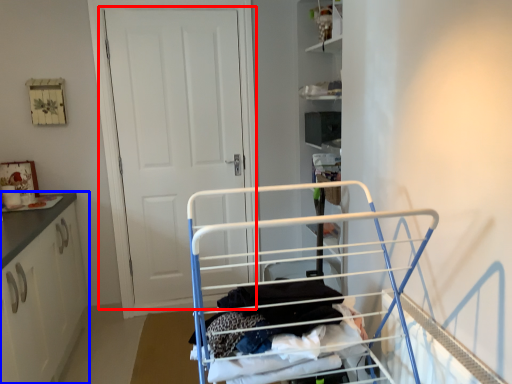
Question: Among these objects, which one is nearest to the camera, door (highlighted by a red box) or cabinetry (highlighted by a blue box)?

Choices:
 (A) door
 (B) cabinetry

Answer: (B)